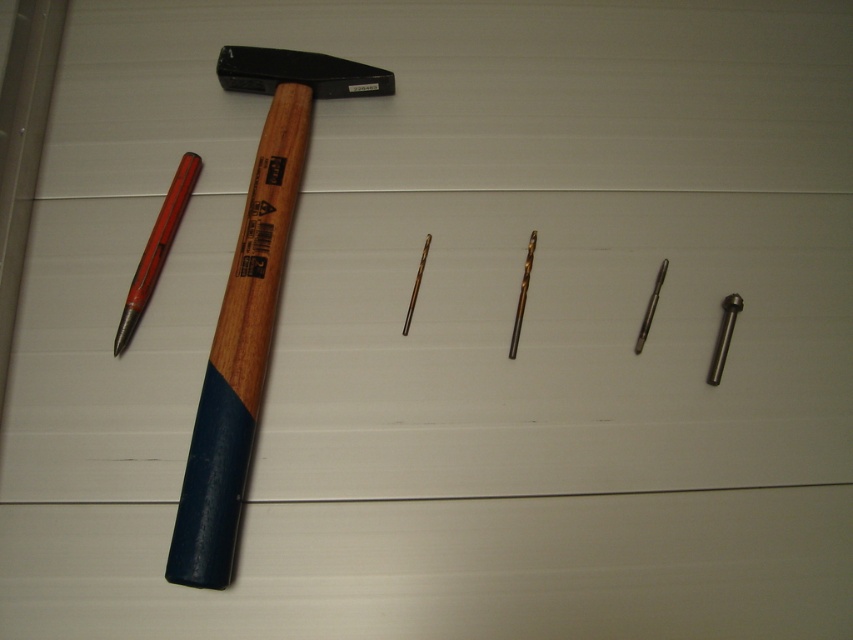
You have a small box that can only fit items wider than the red plastic pen at left. Can the wooden handle hammer at left fit into the box?

The wooden handle hammer at left is wider than the red plastic pen at left, so it cannot fit into the box designed for items wider than the pen.

You are looking at the wooden surface with the tools. There are two points marked on the surface at coordinates point (224, 422) and point (165, 225). If you were to place a small sticker on the point that is closer to you, which coordinate should you choose?

You should choose point (224, 422) because it is closer to the viewer than point (165, 225).

Where is the wooden handle hammer at left located in the image?

The wooden handle hammer at left is located at point (251, 300).